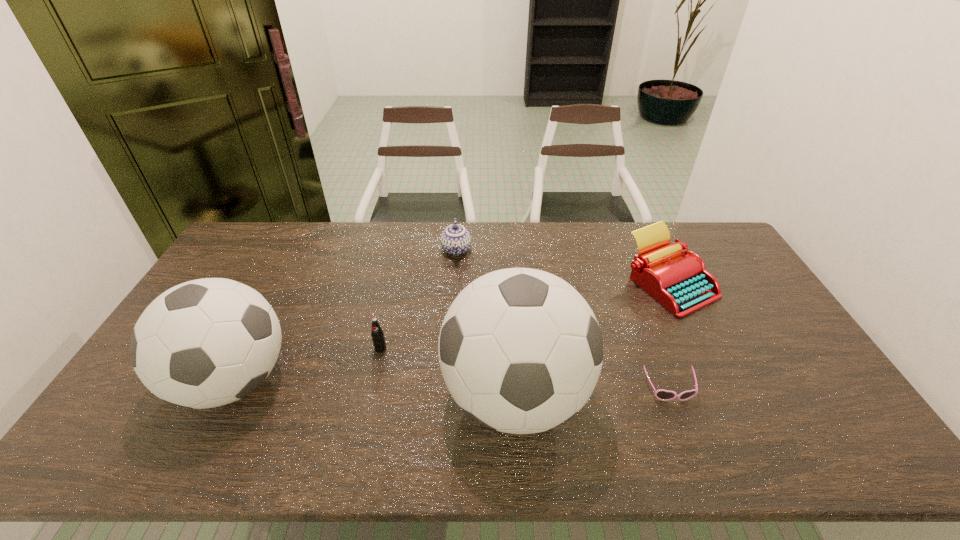
The width and height of the screenshot is (960, 540). Identify the location of the shorter soccer ball. (205, 343).

This screenshot has width=960, height=540. Identify the location of the fifth shortest object. (205, 343).

Where is `the taller soccer ball`? This screenshot has width=960, height=540. the taller soccer ball is located at coordinates (520, 350).

At what (x,y) coordinates should I click in order to perform the action: click on the tallest object. Please return your answer as a coordinate pair (x, y). This screenshot has width=960, height=540. Looking at the image, I should click on (520, 350).

Find the location of a particular element. typewriter is located at coordinates (680, 282).

Locate an element on the screen. chinaware is located at coordinates (455, 240).

You are a GUI agent. You are given a task and a screenshot of the screen. Output one action in this format:
    pyautogui.click(x=<x>, y=<y>)
    Task: Click on the fifth object from right to left
    The image size is (960, 540).
    Given the screenshot: What is the action you would take?
    click(377, 334)

You are a GUI agent. You are given a task and a screenshot of the screen. Output one action in this format:
    pyautogui.click(x=<x>, y=<y>)
    Task: Click on the sunglasses
    This screenshot has height=540, width=960.
    Given the screenshot: What is the action you would take?
    pyautogui.click(x=663, y=395)

The image size is (960, 540). In order to click on vacant region located 0.050m on the left of the second tallest object in this screenshot , I will do `click(156, 381)`.

Locate an element on the screen. This screenshot has height=540, width=960. vacant space located on the right of the right soccer ball is located at coordinates (635, 396).